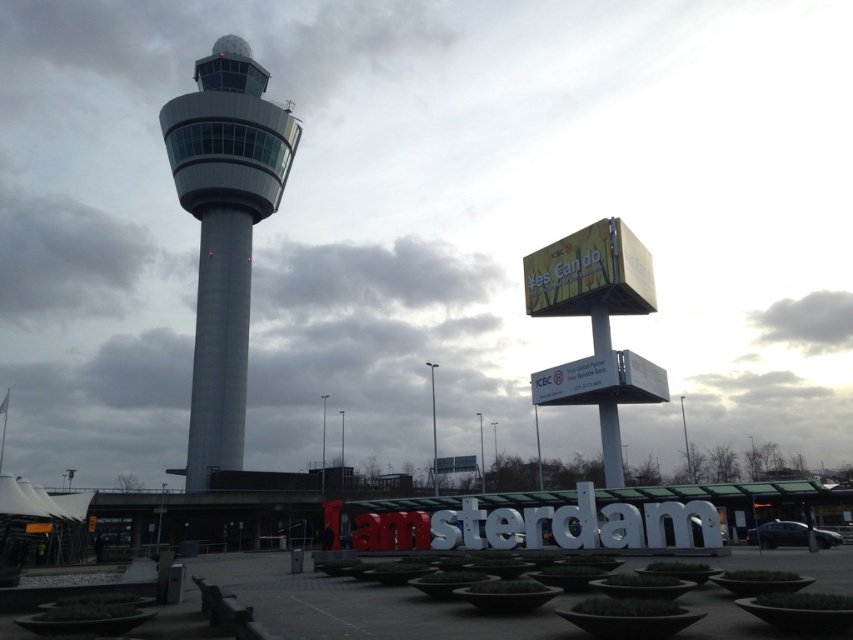
Question: Among these points, which one is farthest from the camera?

Choices:
 (A) (228, 150)
 (B) (549, 388)
 (C) (532, 253)

Answer: (A)

Question: Is smooth gray tower at center below yellow-green cardboard billboard at upper right?

Choices:
 (A) no
 (B) yes

Answer: (A)

Question: Which point is farther to the camera?

Choices:
 (A) (196, 301)
 (B) (622, 365)

Answer: (A)

Question: Which of the following is the closest to the observer?

Choices:
 (A) white plastic sign at center
 (B) yellow-green cardboard billboard at upper right

Answer: (A)

Question: Can you confirm if smooth gray tower at center is wider than yellow-green cardboard billboard at upper right?

Choices:
 (A) yes
 (B) no

Answer: (A)

Question: Is yellow-green cardboard billboard at upper right bigger than white plastic sign at center?

Choices:
 (A) no
 (B) yes

Answer: (B)